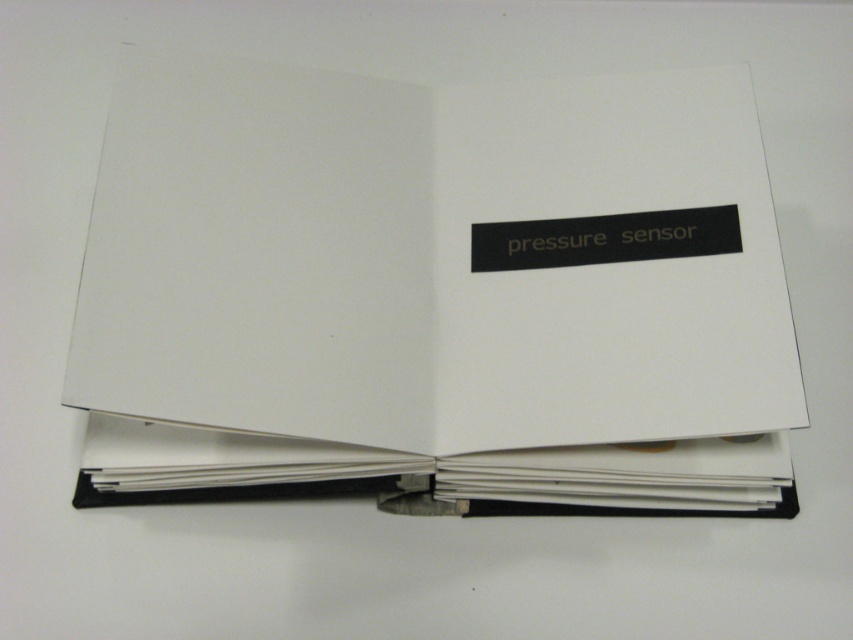
Question: Does white paper journal at center have a lesser width compared to white paper binder at lower center?

Choices:
 (A) no
 (B) yes

Answer: (A)

Question: Does white paper journal at center come behind white paper binder at lower center?

Choices:
 (A) yes
 (B) no

Answer: (B)

Question: Which object appears closest to the camera in this image?

Choices:
 (A) white paper journal at center
 (B) white paper binder at lower center

Answer: (A)

Question: Can you confirm if white paper journal at center is positioned to the right of white paper binder at lower center?

Choices:
 (A) no
 (B) yes

Answer: (B)